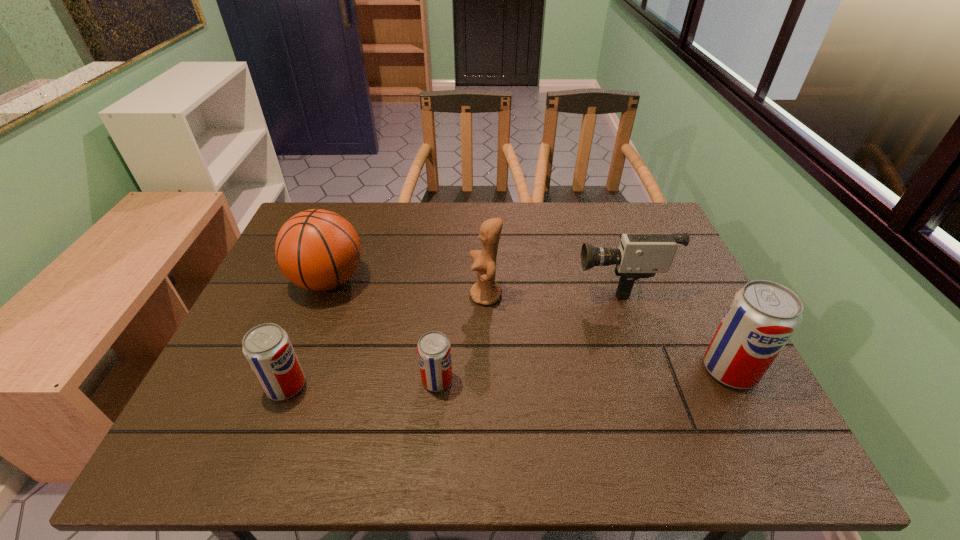
Where is `the second shortest object`? The image size is (960, 540). the second shortest object is located at coordinates (267, 347).

Image resolution: width=960 pixels, height=540 pixels. In order to click on the leftmost soda in this screenshot , I will do `click(267, 347)`.

At what (x,y) coordinates should I click in order to perform the action: click on the shortest object. Please return your answer as a coordinate pair (x, y). The height and width of the screenshot is (540, 960). Looking at the image, I should click on (434, 351).

You are a GUI agent. You are given a task and a screenshot of the screen. Output one action in this format:
    pyautogui.click(x=<x>, y=<y>)
    Task: Click on the fourth object from right to left
    This screenshot has width=960, height=540.
    Given the screenshot: What is the action you would take?
    pyautogui.click(x=434, y=351)

This screenshot has height=540, width=960. Find the location of `the rightmost object`. the rightmost object is located at coordinates 763,315.

The height and width of the screenshot is (540, 960). I want to click on the tallest soda, so click(763, 315).

Where is `camcorder`? camcorder is located at coordinates (639, 256).

You are a GUI agent. You are given a task and a screenshot of the screen. Output one action in this format:
    pyautogui.click(x=<x>, y=<y>)
    Task: Click on the third object from right to left
    The width and height of the screenshot is (960, 540).
    Given the screenshot: What is the action you would take?
    pyautogui.click(x=486, y=291)

Where is `basketball`? The image size is (960, 540). basketball is located at coordinates (318, 250).

Locate an element on the screen. The width and height of the screenshot is (960, 540). free space located 0.290m on the right of the second tallest soda is located at coordinates (437, 386).